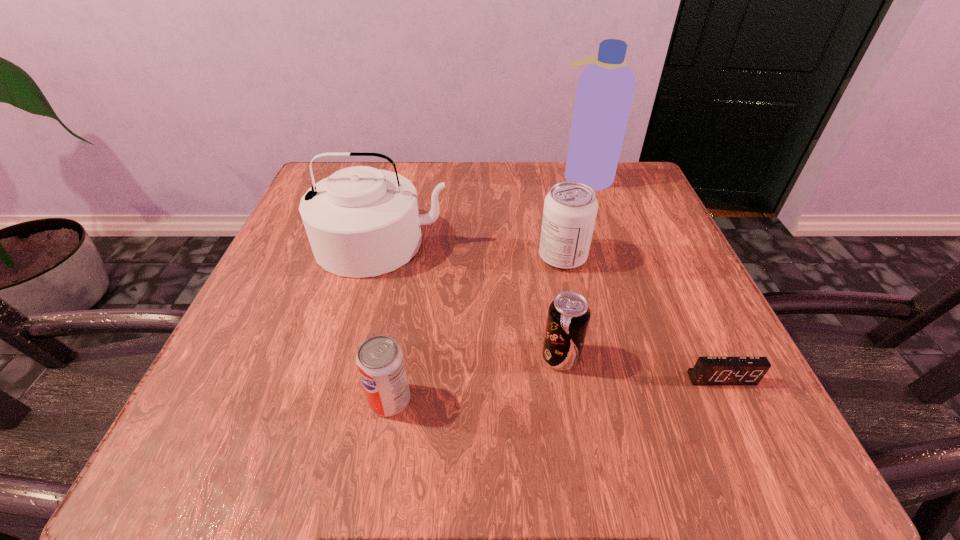
This screenshot has height=540, width=960. I want to click on vacant area that satisfies the following two spatial constraints: 1. on the spout of the kettle; 2. on the right side of the farthest soda, so click(378, 257).